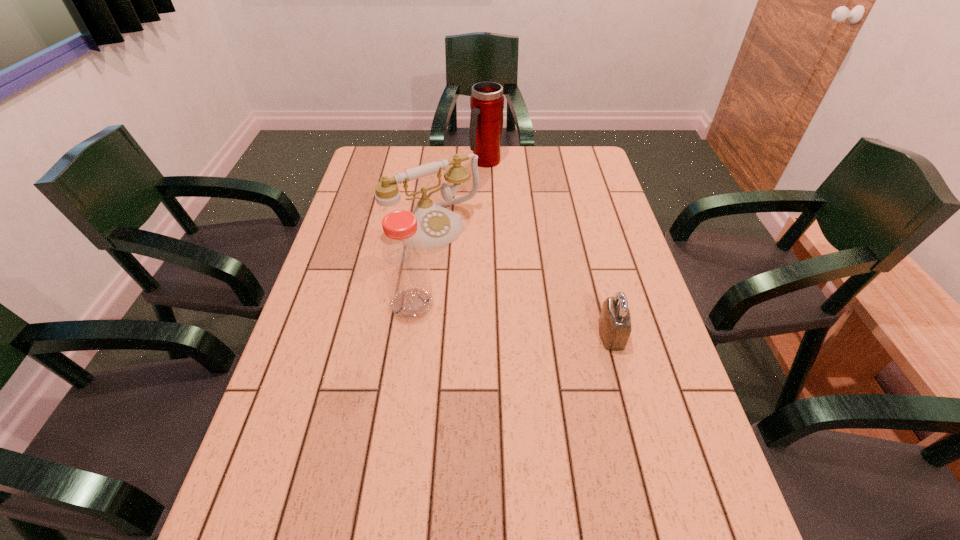
In order to click on bottle in this screenshot , I will do `click(405, 261)`.

This screenshot has height=540, width=960. I want to click on the rightmost object, so click(614, 321).

In order to click on padlock in this screenshot , I will do `click(614, 321)`.

Find the location of `thermos bottle`. thermos bottle is located at coordinates (487, 101).

Locate an element on the screen. Image resolution: width=960 pixels, height=540 pixels. the second shortest object is located at coordinates (438, 226).

Where is `the second farthest object`? This screenshot has width=960, height=540. the second farthest object is located at coordinates (438, 226).

You are a GUI agent. You are given a task and a screenshot of the screen. Output one action in this format:
    pyautogui.click(x=<x>, y=<y>)
    Task: Click on the free spot located 0.310m on the front of the bottle
    The image size is (960, 540).
    Given the screenshot: What is the action you would take?
    pyautogui.click(x=393, y=438)

In order to click on free region located on the side with the handle of the thermos bottle in this screenshot , I will do `click(497, 209)`.

Locate an element on the screen. free space located 0.130m on the side with the handle of the thermos bottle is located at coordinates (492, 192).

Where is `free space located on the side with the handle of the thermos bottle`? This screenshot has width=960, height=540. free space located on the side with the handle of the thermos bottle is located at coordinates (497, 209).